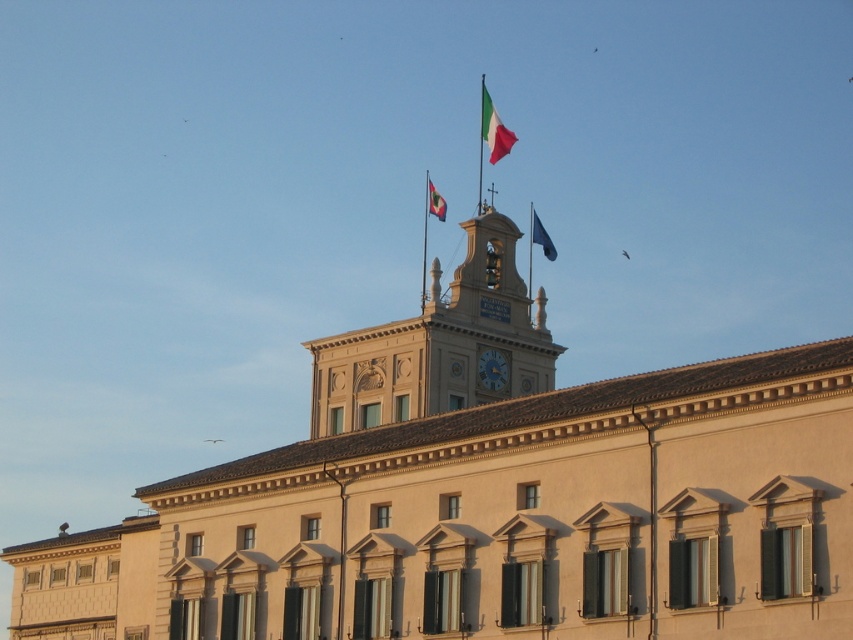
Question: Does matte gold clock at center appear over matte red flag at upper center?

Choices:
 (A) yes
 (B) no

Answer: (B)

Question: Which point is closer to the camera?

Choices:
 (A) red fabric flag at upper center
 (B) matte gold clock at center
 (C) blue fabric flag at upper center

Answer: (B)

Question: Does matte gold clock at center appear on the right side of matte red flag at upper center?

Choices:
 (A) yes
 (B) no

Answer: (A)

Question: Which object is closer to the camera taking this photo?

Choices:
 (A) blue fabric flag at upper center
 (B) matte red flag at upper center
 (C) matte gold clock at center
 (D) red fabric flag at upper center

Answer: (C)

Question: Which object is the closest to the blue fabric flag at upper center?

Choices:
 (A) matte gold clock at center
 (B) matte red flag at upper center

Answer: (B)

Question: Is red fabric flag at upper center in front of matte gold clock at center?

Choices:
 (A) yes
 (B) no

Answer: (B)